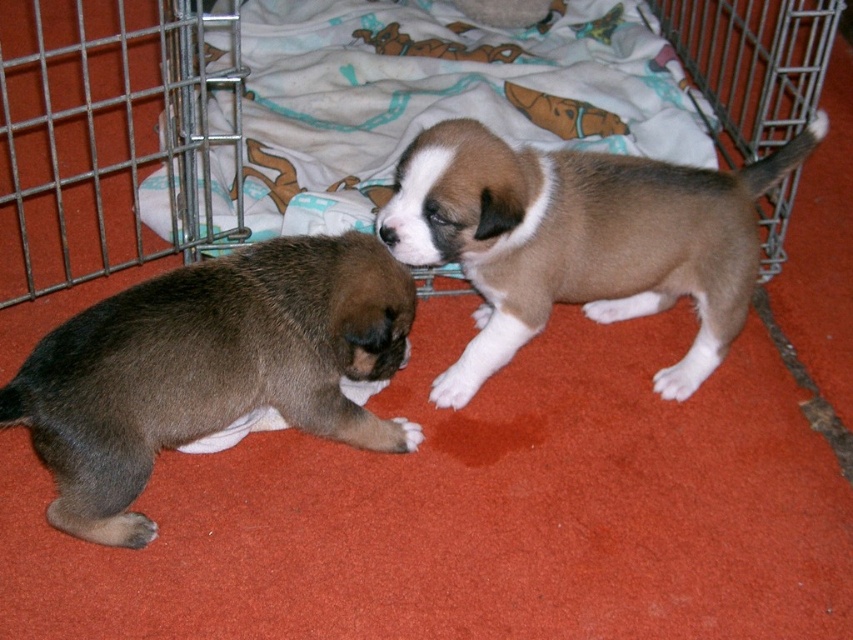
You are a dog trainer observing two puppies in a metal crate. You see a brown fur puppy at center and a metal wire cage at upper left. Which puppy is closer to the right side of the crate?

The brown fur puppy at center is closer to the right side of the crate because it is positioned to the right of the metal wire cage at upper left.

You are trying to determine if there is enough space in the metal wire cage at upper left to add another small toy. Given the current arrangement with the brown fuzzy puppy at lower left inside, can you fit the toy?

The brown fuzzy puppy at lower left occupies less space than metal wire cage at upper left, so there is likely enough space to add another small toy inside the metal wire cage at upper left.

You are a dog breeder who needs to ensure the puppies are comfortable. The crate has limited space. Which puppy, the brown fuzzy puppy at lower left or the brown fur puppy at center, requires more space due to its size?

The brown fur puppy at center requires more space because it is larger than the brown fuzzy puppy at lower left.